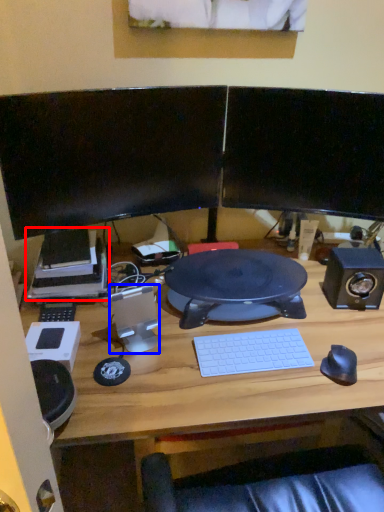
Question: Which point is further to the camera, printer (highlighted by a red box) or speaker (highlighted by a blue box)?

Choices:
 (A) printer
 (B) speaker

Answer: (A)